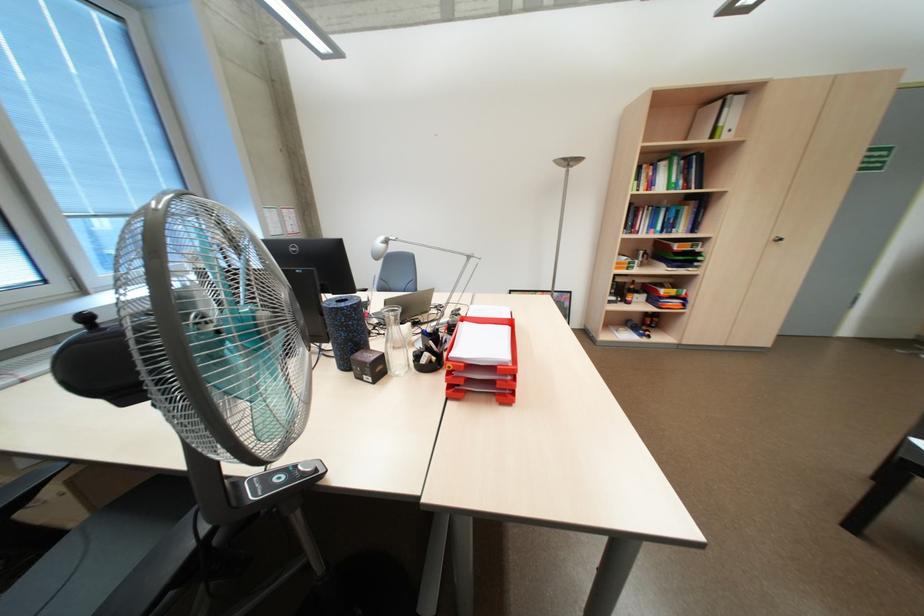
The width and height of the screenshot is (924, 616). What do you see at coordinates (430, 349) in the screenshot?
I see `the pen in holder` at bounding box center [430, 349].